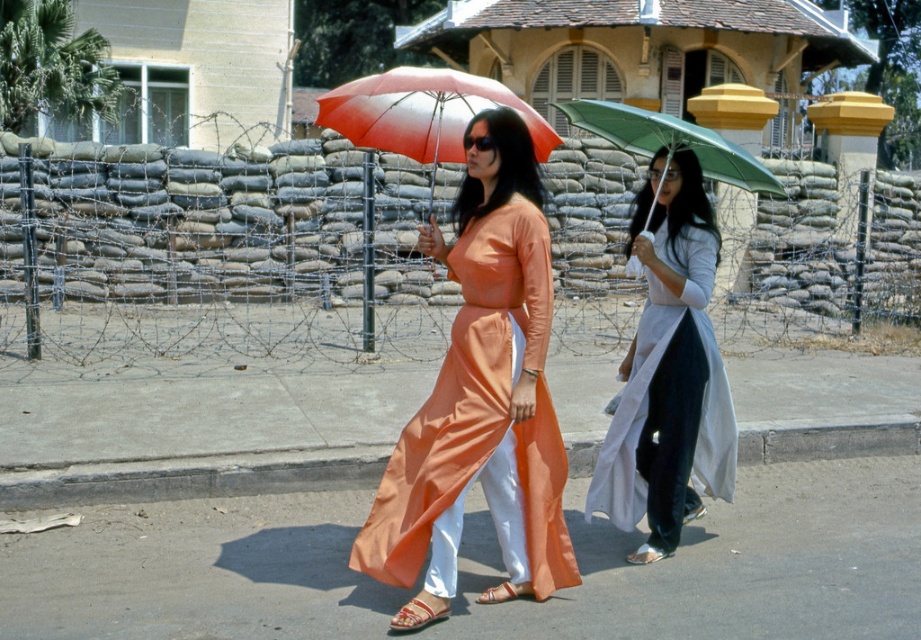
You are a delivery robot with a height of 3 feet. You need to deliver a package to the white silk ao dai at center. The smooth asphalt at lower center is in your path. Can you pass through the space between them without hitting your head?

The distance between the smooth asphalt at lower center and white silk ao dai at center is 30.62 inches. Since the robot is 3 feet tall, which is 36 inches, it cannot pass through the space as the height is insufficient.

You are a photographer trying to capture a photo of the white silk ao dai at center and the smooth asphalt at lower center. To ensure both subjects are in focus, you need to know their relative positions. Which object is positioned to the right of the other?

The smooth asphalt at lower center is to the right of the white silk ao dai at center.